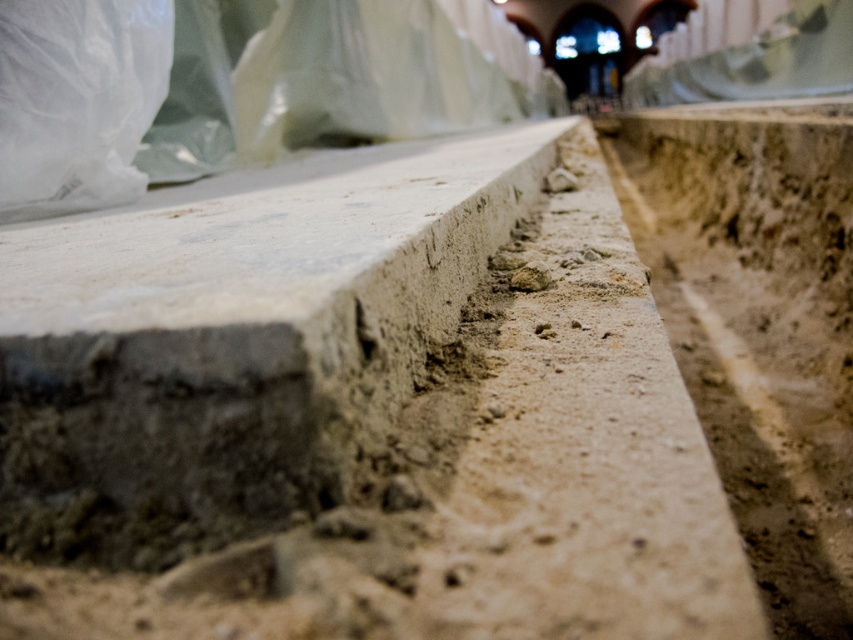
You are a construction worker holding a 12 inch measuring tape. You want to measure the distance between the smooth concrete at center and the camera. Can you do it with your measuring tape?

The distance between the smooth concrete at center and the camera is 20.41 inches, which is longer than your 12 inch measuring tape. You will need a longer measuring tool to measure this distance.

You are a construction worker checking the site. You see the smooth concrete at center and the transparent plastic bag at upper left. Which object is nearer to you?

The smooth concrete at center is closer to the viewer than the transparent plastic bag at upper left.

You are a construction worker carrying a tool box that is 3 feet wide. You need to move from the transparent plastic bag at upper left to the smooth concrete at center. Is there enough space for your tool box to pass through the gap between them?

The distance between the smooth concrete at center and the transparent plastic bag at upper left is 4.51 feet. Since your tool box is 3 feet wide, there is enough space for it to pass through the gap.